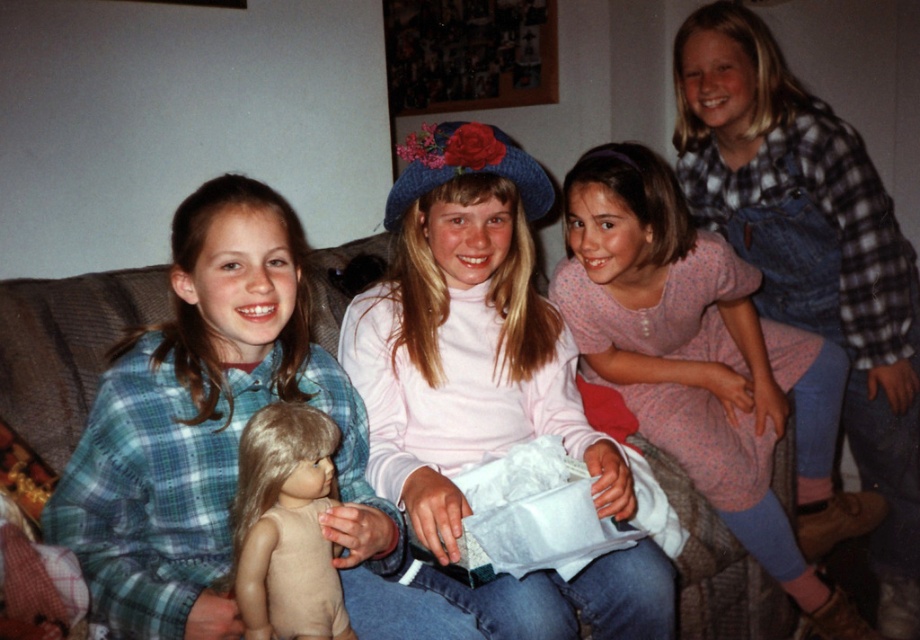
You are standing in the living room and want to hand a small note to the girl wearing the matte pink turtleneck at center. To do so, you need to determine her exact position. Based on the coordinates provided, where should you walk to find her?

The matte pink turtleneck at center is located at point (486, 385), so you should walk to that coordinate to hand the note.

Where is the matte pink turtleneck at center located in the image?

The matte pink turtleneck at center is located at point 0.603 on the x axis and 0.529 on the y axis.